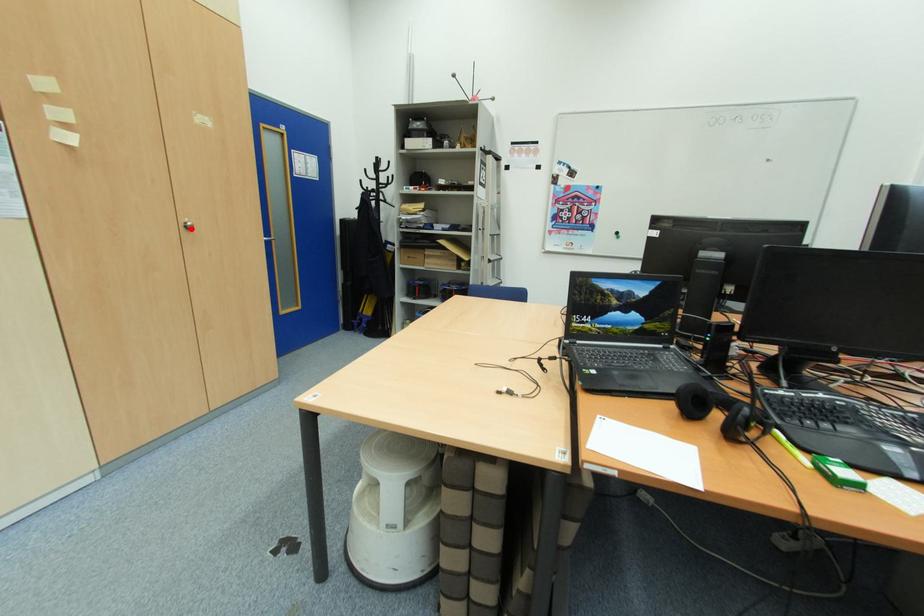
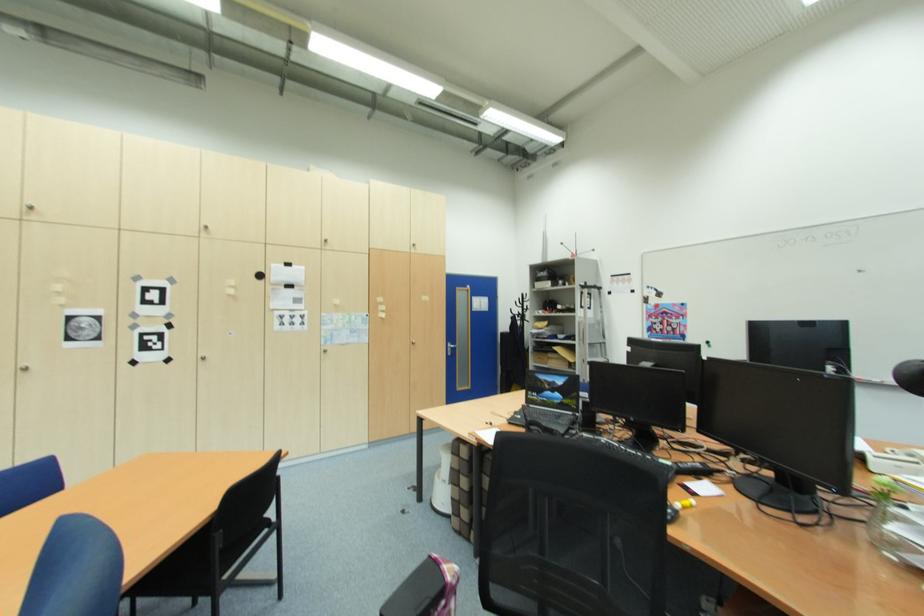
The point at the highlighted location is marked in the first image. Where is the corresponding point in the second image?

(418, 345)